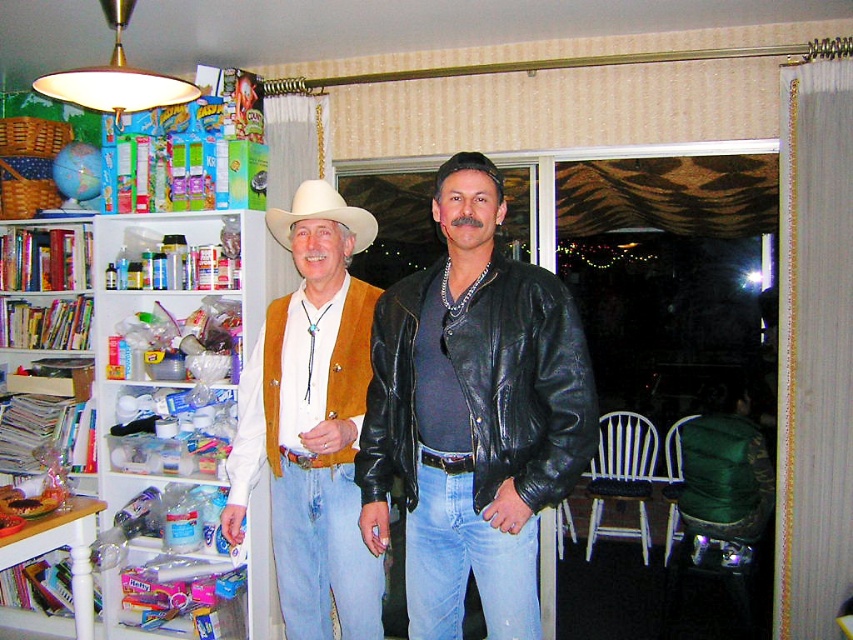
You are a photographer setting up a shoot in this living room. You need to place a small prop between the matte brown vest at left and the white matte cowboy hat at center. Since the prop can only fit in a space that accommodates the smaller of the two objects, which object determines the maximum size of the prop?

The white matte cowboy hat at center is the smaller object between the matte brown vest at left and the white matte cowboy hat at center. Therefore, the maximum size of the prop should be based on the size of the white matte cowboy hat at center to ensure it fits.

You are trying to locate the matte brown vest at left and the white matte cowboy hat at center in the image. Based on their positions, which object is closer to the right side of the image?

The matte brown vest at left is to the right of the white matte cowboy hat at center, so the matte brown vest at left is closer to the right side of the image.

You are planning to buy a new coat that needs to fit into your existing wardrobe which has a width capacity of 40 cm. You have a matte brown vest at left and a white matte cowboy hat at center. Which item will definitely fit into the wardrobe based on their widths?

The white matte cowboy hat at center will definitely fit into the wardrobe since the matte brown vest at left is wider than it, and the wardrobe can hold up to 40 cm. If the vest is wider than the hat, and the wardrobe can fit 40 cm, then the hat, being narrower, should fit as long as its width is under 40 cm. However, since the vest is wider than the hat but we don not know the exact width of the vest, but the question is which will definitely fit. Since the vest is wider than the hat, if the vest is over